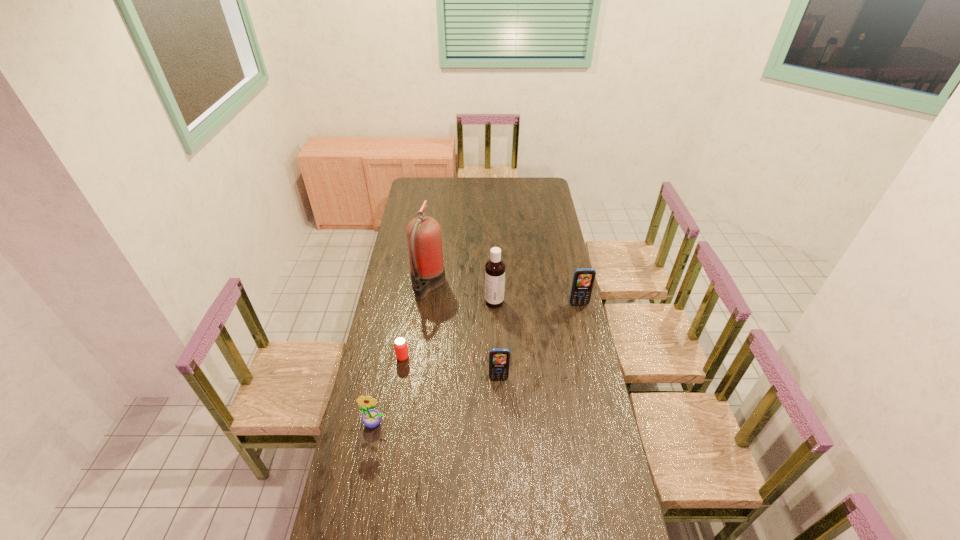
Locate an element on the screen. This screenshot has height=540, width=960. object that is at the right edge is located at coordinates (583, 280).

At what (x,y) coordinates should I click in order to perform the action: click on free space at the far edge of the desktop. Please return your answer as a coordinate pair (x, y). The image size is (960, 540). Looking at the image, I should click on (499, 194).

What are the coordinates of `free region at the near edge of the desktop` in the screenshot? It's located at (462, 521).

The image size is (960, 540). Identify the location of free space at the left edge of the desktop. (385, 305).

In the image, there is a desktop. Identify the location of vacant space at the right edge. pos(548,204).

Find the location of a particular element. The height and width of the screenshot is (540, 960). blank space at the far right corner of the desktop is located at coordinates (549, 180).

I want to click on vacant area that lies between the dishwasher detergent and the beer can, so click(448, 329).

This screenshot has height=540, width=960. I want to click on vacant area that lies between the beer can and the farther cellular telephone, so click(491, 330).

Where is `free space between the second nearest object and the second tallest object`? free space between the second nearest object and the second tallest object is located at coordinates (496, 340).

The image size is (960, 540). I want to click on free space between the sunflower and the shortest object, so click(389, 390).